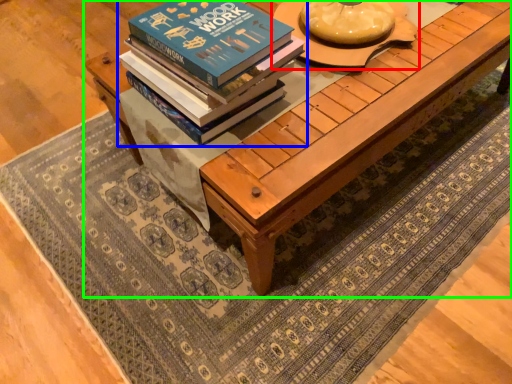
Question: Which is nearer to the round table (highlighted by a red box)? book (highlighted by a blue box) or table (highlighted by a green box).

Choices:
 (A) book
 (B) table

Answer: (B)